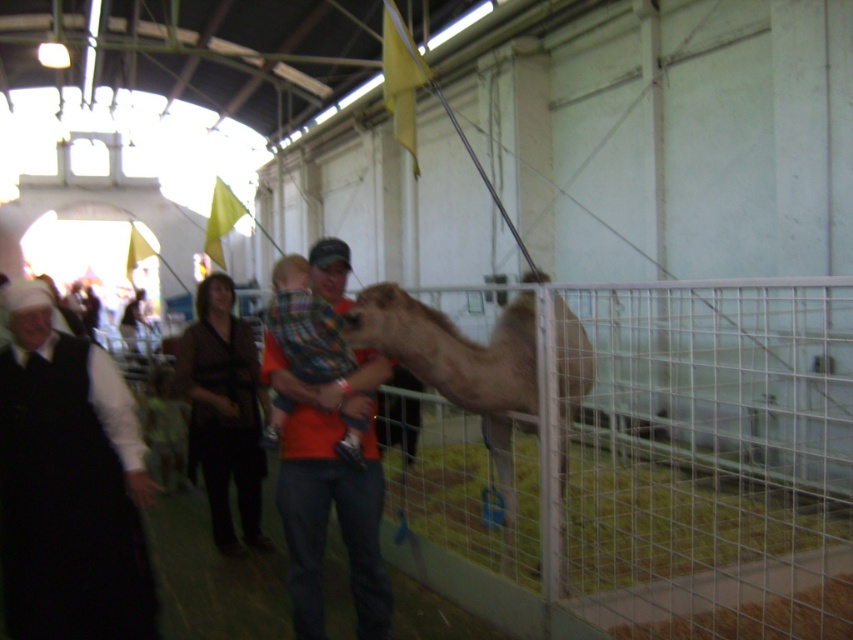
In the scene shown: You are a visitor at the exhibition hall and want to take a photo of the orange cotton shirt at center without the white wire fence at right appearing in the background. Is this possible given their positions?

The white wire fence at right is further to the viewer than the orange cotton shirt at center, so it is closer to you. To avoid the fence in the background, you would need to position yourself so the orange cotton shirt at center is between you and the fence. However, since the fence is closer, it might still block the view unless you move to a side angle where the shirt obscures the fence.

From the picture: You are a visitor in the exhibition hall and want to take a photo of the camel. The white wire fence at right and the black fabric at left are in the background. Which background element is on the left side of the photo?

The black fabric at left is on the left side of the photo because the white wire fence at right is positioned on the right side of it.

You are a visitor at the exhibition hall and want to take a photo of the camel. The white wire fence at right and the black fabric at left are both in your view. Which object should you focus on to ensure the camel is centered in your photo?

To center the camel in your photo, focus on the white wire fence at right because it is larger in size than the black fabric at left, meaning it occupies more space in the frame and can help guide the composition towards the camel.